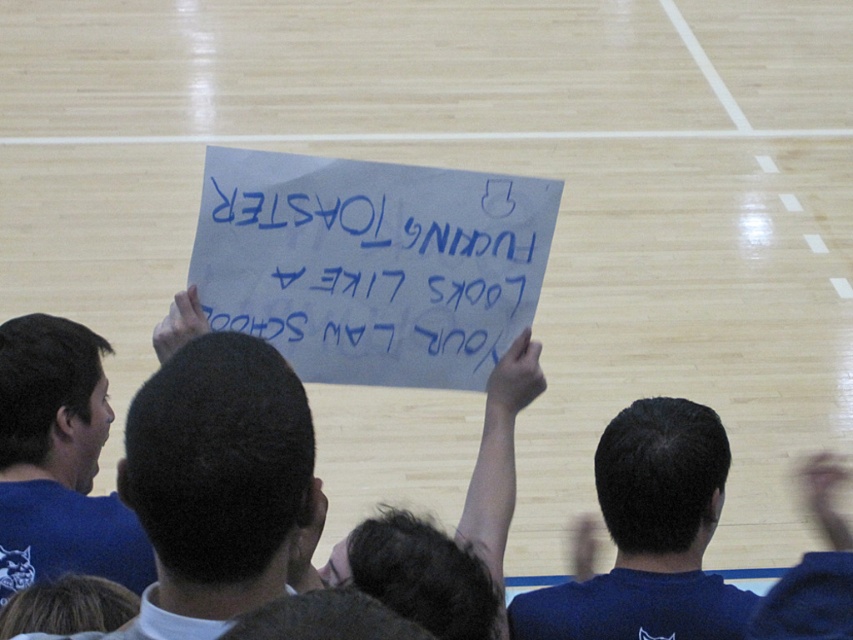
Question: Is white paper sign at center positioned before blue fabric shirt at upper center?

Choices:
 (A) no
 (B) yes

Answer: (A)

Question: Which point appears farthest from the camera in this image?

Choices:
 (A) (474, 385)
 (B) (498, 577)

Answer: (A)

Question: Does white paper sign at center appear on the right side of blue fabric shirt at upper center?

Choices:
 (A) no
 (B) yes

Answer: (B)

Question: Where is white paper sign at center located in relation to blue fabric shirt at upper center in the image?

Choices:
 (A) above
 (B) below

Answer: (A)